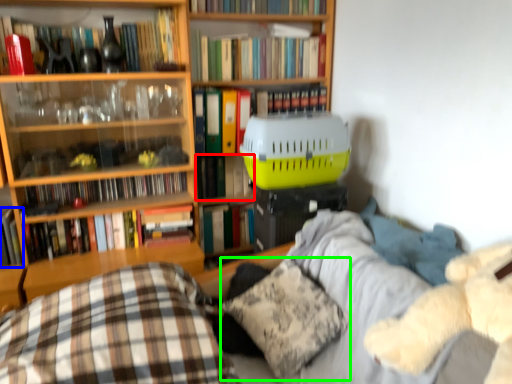
Question: Which is nearer to the book (highlighted by a red box)? book (highlighted by a blue box) or pillow (highlighted by a green box).

Choices:
 (A) book
 (B) pillow

Answer: (B)